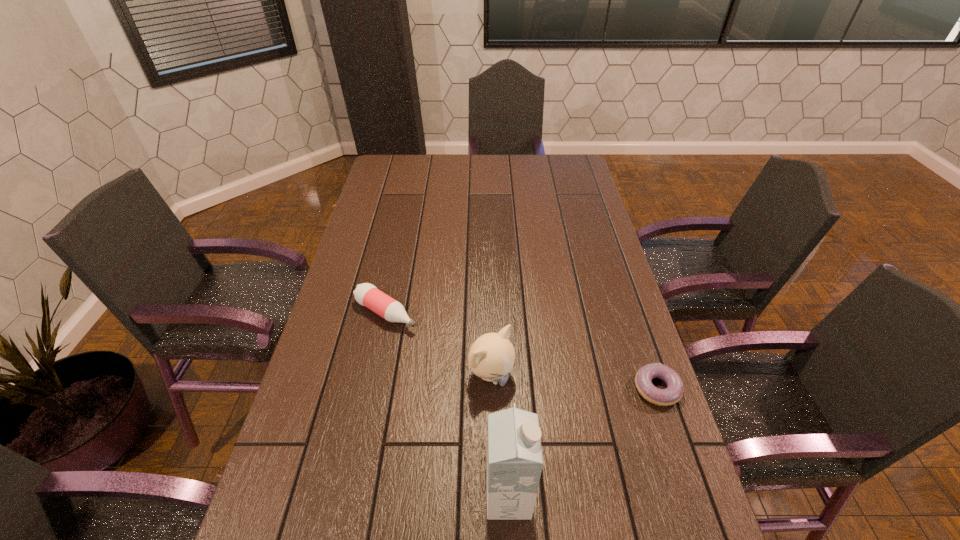
Identify the location of vacant space located 0.350m with the cap open on the third tallest object. The image size is (960, 540). (511, 389).

The width and height of the screenshot is (960, 540). Identify the location of vacant space positioned 0.390m with the cap open on the third tallest object. (523, 398).

The height and width of the screenshot is (540, 960). I want to click on free space located on the face of the kitten, so click(x=647, y=504).

I want to click on free space located on the face of the kitten, so click(x=591, y=457).

The image size is (960, 540). In order to click on vacant space located 0.190m on the face of the kitten in this screenshot , I will do `click(569, 440)`.

I want to click on object that is at the near edge, so click(514, 455).

I want to click on object at the left edge, so click(x=366, y=294).

This screenshot has width=960, height=540. I want to click on object that is positioned at the right edge, so click(673, 393).

In order to click on free point at the far edge in this screenshot , I will do `click(468, 173)`.

At what (x,y) coordinates should I click in order to perform the action: click on vacant space at the near edge of the desktop. Please return your answer as a coordinate pair (x, y). This screenshot has width=960, height=540. Looking at the image, I should click on pyautogui.click(x=376, y=527).